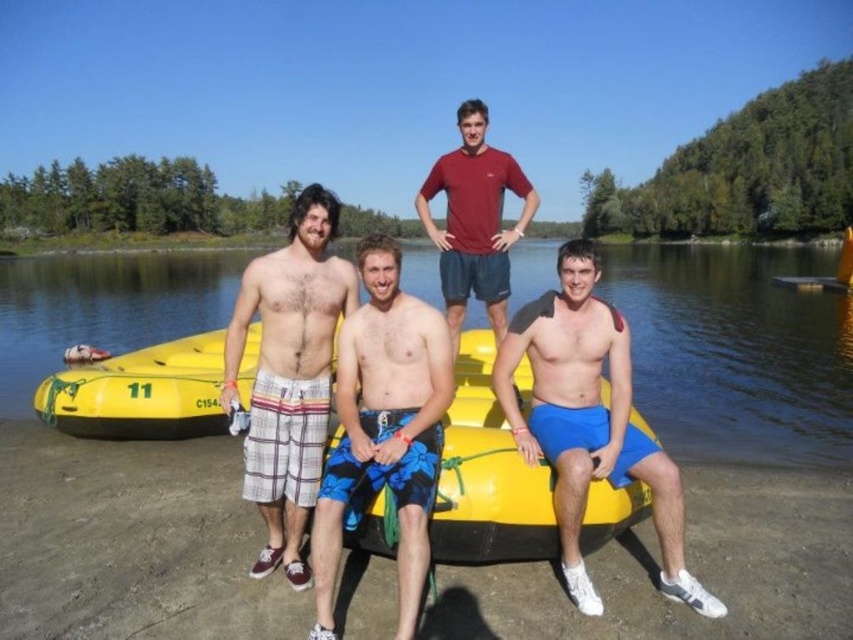
You are a photographer trying to capture a photo of the yellow rubber raft at center and the blue printed shorts at center. Based on their positions, which object will appear larger in the photo?

The yellow rubber raft at center will appear larger in the photo because it is much taller than the blue printed shorts at center.

You are planning to take a photo of the yellow rubber raft at center. Where exactly should you aim your camera to capture it perfectly?

You should aim your camera at point (735,349) to capture the yellow rubber raft at center perfectly.